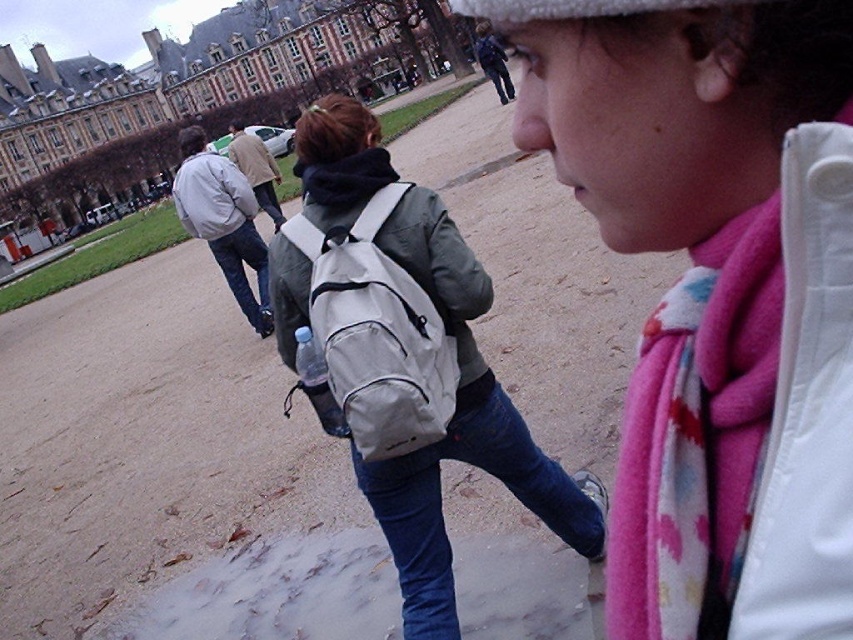
Looking at this image, you are a photographer trying to capture both the matte gray backpack at center and the light gray backpack at center in the same frame. Based on their positions, which backpack will appear closer to you in the photo?

The matte gray backpack at center will appear closer to you because it is positioned in front of the light gray backpack at center.

You are a delivery person who needs to place a package on the matte gray backpack at center and the light gray backpack at center. Which backpack should you place it on if the package needs to be placed on the one that is lower?

The matte gray backpack at center is located below the light gray backpack at center, so you should place the package on the matte gray backpack at center since it is lower.

You are standing in the public square and want to walk to the point that is closer to you. Which point should you head towards, point (531, 456) or point (195, 234)?

You should head towards point (531, 456) because it is closer to the viewer than point (195, 234).